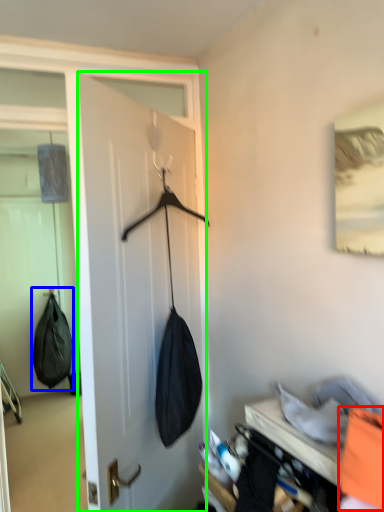
Question: Which object is the closest to the clothing (highlighted by a red box)? Choose among these: shoulder bag (highlighted by a blue box) or door (highlighted by a green box).

Choices:
 (A) shoulder bag
 (B) door

Answer: (B)